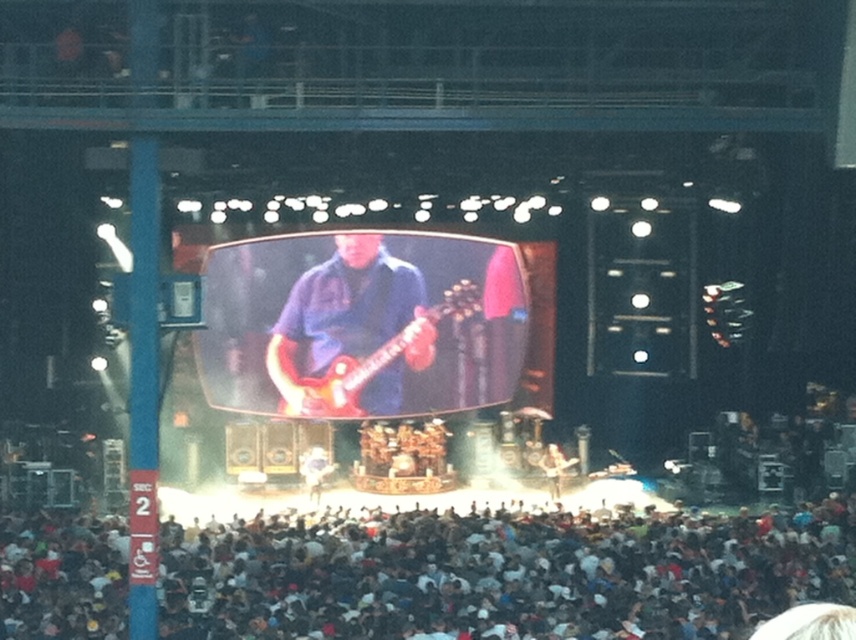
Question: Considering the relative positions of white cotton crowd at lower center and shiny red electric guitar at center in the image provided, where is white cotton crowd at lower center located with respect to shiny red electric guitar at center?

Choices:
 (A) above
 (B) below

Answer: (B)

Question: Which object appears closest to the camera in this image?

Choices:
 (A) white cotton crowd at lower center
 (B) shiny red electric guitar at center

Answer: (A)

Question: Can you confirm if white cotton crowd at lower center is positioned to the left of shiny red electric guitar at center?

Choices:
 (A) yes
 (B) no

Answer: (B)

Question: Can you confirm if white cotton crowd at lower center is positioned above shiny red electric guitar at center?

Choices:
 (A) yes
 (B) no

Answer: (B)

Question: Among these objects, which one is farthest from the camera?

Choices:
 (A) shiny red electric guitar at center
 (B) white cotton crowd at lower center

Answer: (A)